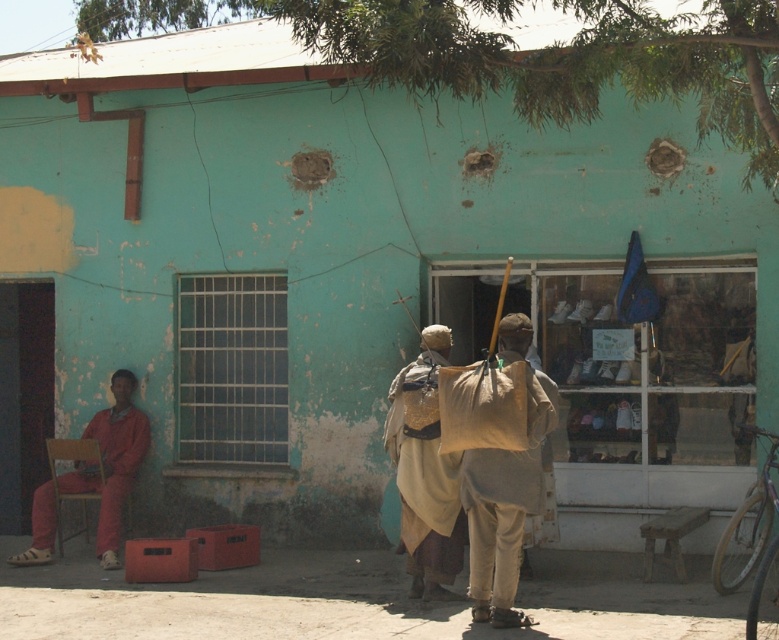
Does beige sack at center appear on the left side of beige fabric bag at center?

In fact, beige sack at center is to the right of beige fabric bag at center.

Does beige sack at center have a lesser width compared to beige fabric bag at center?

No.

Locate an element on the screen. The width and height of the screenshot is (779, 640). beige sack at center is located at coordinates (506, 490).

What do you see at coordinates (506, 490) in the screenshot? I see `beige sack at center` at bounding box center [506, 490].

Measure the distance from beige sack at center to matte orange jumpsuit at left.

A distance of 13.34 feet exists between beige sack at center and matte orange jumpsuit at left.

Does point (490, 593) come farther from viewer compared to point (127, 460)?

No, it is in front of (127, 460).

The image size is (779, 640). What are the coordinates of `beige sack at center` in the screenshot? It's located at (506, 490).

Between beige fabric bag at center and matte orange jumpsuit at left, which one appears on the left side from the viewer's perspective?

From the viewer's perspective, matte orange jumpsuit at left appears more on the left side.

Based on the photo, can you confirm if beige fabric bag at center is positioned to the left of matte orange jumpsuit at left?

In fact, beige fabric bag at center is to the right of matte orange jumpsuit at left.

This screenshot has height=640, width=779. I want to click on beige fabric bag at center, so click(x=425, y=472).

Image resolution: width=779 pixels, height=640 pixels. In order to click on beige fabric bag at center in this screenshot , I will do (x=425, y=472).